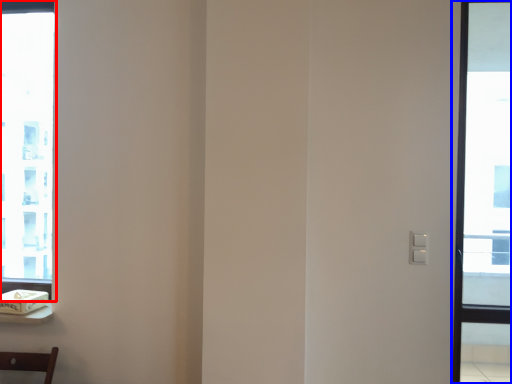
Question: Among these objects, which one is nearest to the camera, window (highlighted by a red box) or window (highlighted by a blue box)?

Choices:
 (A) window
 (B) window

Answer: (B)